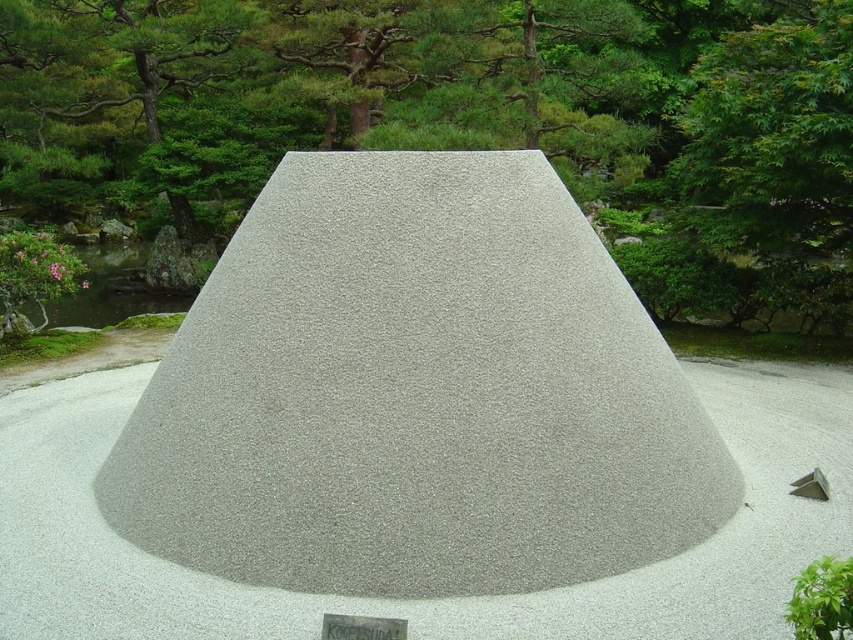
You are standing at the center of the garden and want to locate the green textured tree at center. Which direction should you look to find it?

The green textured tree at center is located at point coordinates of 0.167 on the x axis and 0.531 on the y axis. Since the coordinates are less than 0.5 on both axes, the tree is to the lower left direction from the center.

You are designing a garden layout and want to place a new statue between the green textured tree at center and the gray gravel mound at center. Which object should the statue be closer to if it needs to be placed closer to the wider object?

The green textured tree at center is wider than the gray gravel mound at center, so the statue should be placed closer to the green textured tree at center.

Based on the photo, you are standing in the garden and want to touch the green textured tree at center and the gray gravel mound at center. Which object will you reach first?

You will reach the green textured tree at center first because it is closer to you than the gray gravel mound at center.